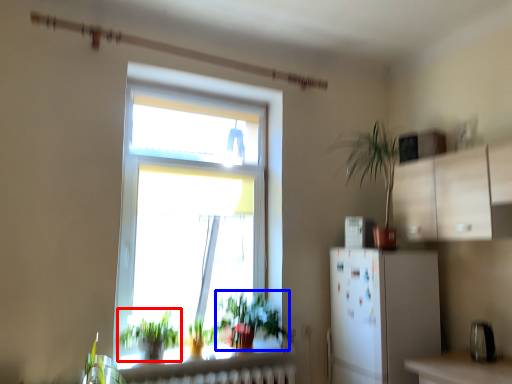
Question: Which point is further to the camera, vegetation (highlighted by a red box) or vegetation (highlighted by a blue box)?

Choices:
 (A) vegetation
 (B) vegetation

Answer: (B)